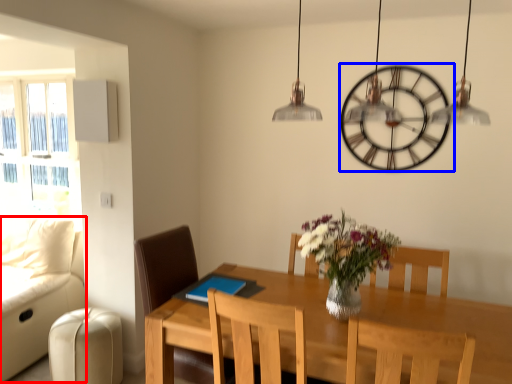
Question: Which of the following is the farthest to the observer, couch (highlighted by a red box) or wall clock (highlighted by a blue box)?

Choices:
 (A) couch
 (B) wall clock

Answer: (B)